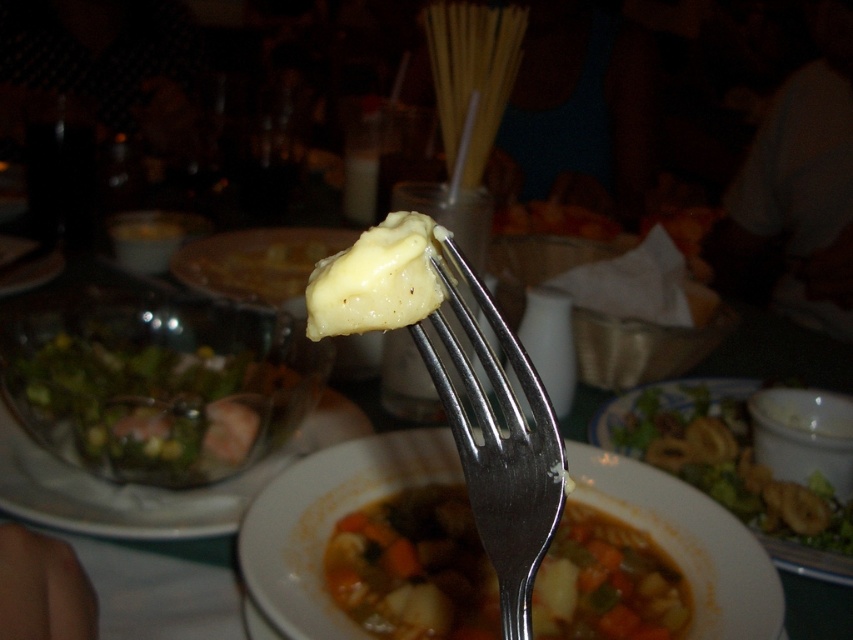
Question: Does yellow creamy substance at center have a smaller size compared to yellow creamy cheese at fork tip?

Choices:
 (A) yes
 (B) no

Answer: (A)

Question: In this image, where is yellow creamy substance at center located relative to silver metallic fork at center?

Choices:
 (A) right
 (B) left

Answer: (A)

Question: Which of the following is the closest to the observer?

Choices:
 (A) (315, 273)
 (B) (602, 545)

Answer: (A)

Question: Which point is closer to the camera taking this photo?

Choices:
 (A) (430, 256)
 (B) (287, 284)
 (C) (15, 422)

Answer: (A)

Question: Which of the following is the closest to the observer?

Choices:
 (A) yellow creamy substance at center
 (B) yellow creamy cheese at fork center
 (C) silver metallic fork at center

Answer: (C)

Question: In this image, where is yellow creamy substance at center located relative to translucent glass bowl at center?

Choices:
 (A) above
 (B) below

Answer: (B)